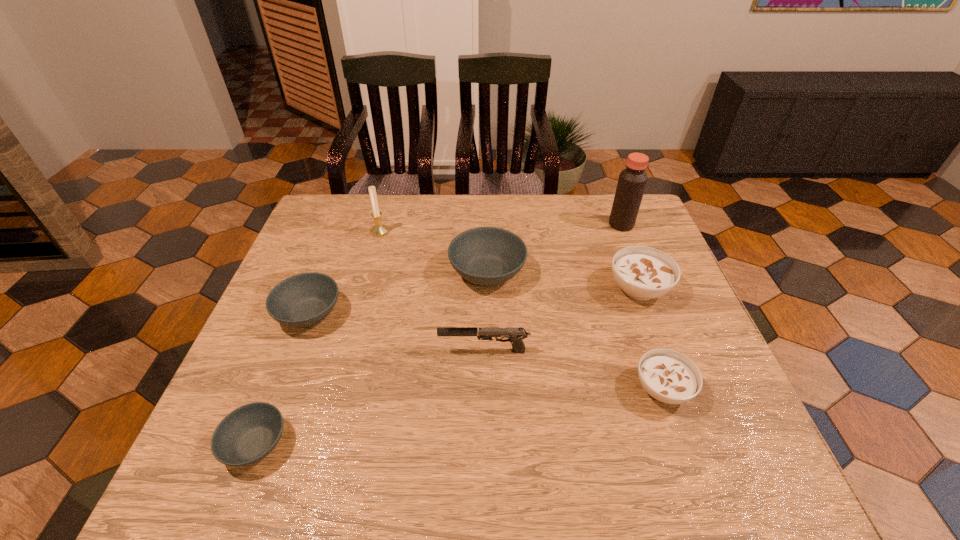
Where is `blank space at the near edge`? The width and height of the screenshot is (960, 540). blank space at the near edge is located at coordinates pos(653,478).

Image resolution: width=960 pixels, height=540 pixels. Identify the location of vacant space at the left edge. (351, 251).

I want to click on vacant area at the right edge of the desktop, so click(732, 415).

The image size is (960, 540). Find the location of `blank space at the far left corner`. blank space at the far left corner is located at coordinates (313, 219).

Identify the location of vacant space at the far right corner. (595, 211).

Where is `free area in between the smaller white soup bowl and the vinegar`? This screenshot has width=960, height=540. free area in between the smaller white soup bowl and the vinegar is located at coordinates (642, 307).

Identify the location of empty space between the gray gun and the nearer white soup bowl. Image resolution: width=960 pixels, height=540 pixels. (573, 370).

Locate an element on the screen. This screenshot has height=540, width=960. vacant space that's between the nearer white soup bowl and the candle holder is located at coordinates (521, 310).

Where is `free space between the nearer white soup bowl and the second biggest gray soup bowl`? The image size is (960, 540). free space between the nearer white soup bowl and the second biggest gray soup bowl is located at coordinates [486, 351].

Find the location of a particular element. This screenshot has height=540, width=960. vacant space that is in between the second biggest gray soup bowl and the nearest gray soup bowl is located at coordinates (282, 379).